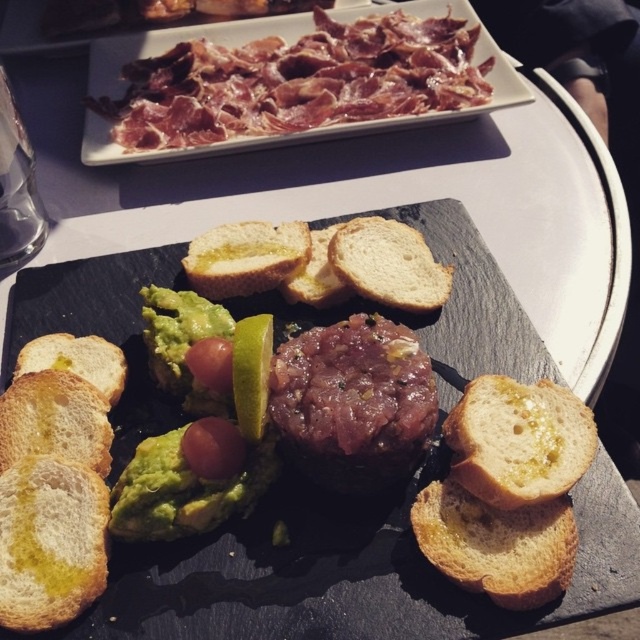
Can you confirm if olive oil toasted bread at center is taller than green creamy guacamole at center-left?

Incorrect, olive oil toasted bread at center's height is not larger of green creamy guacamole at center-left's.

Which is above, olive oil toasted bread at center or green creamy guacamole at center-left?

green creamy guacamole at center-left

Who is more forward, (x=445, y=429) or (x=192, y=394)?

Point (x=445, y=429) is more forward.

This screenshot has height=640, width=640. I want to click on olive oil toasted bread at center, so click(518, 440).

Does point (557, 541) lie in front of point (44, 348)?

Yes, point (557, 541) is closer to viewer.

Is golden crispy bread at lower right above olive oil toasted bread at lower left?

No, golden crispy bread at lower right is not above olive oil toasted bread at lower left.

Where is `golden crispy bread at lower right`? golden crispy bread at lower right is located at coordinates (497, 545).

You are a GUI agent. You are given a task and a screenshot of the screen. Output one action in this format:
    pyautogui.click(x=<x>, y=<y>)
    Task: Click on the golden crispy bread at lower right
    
    Given the screenshot: What is the action you would take?
    pyautogui.click(x=497, y=545)

Between olive oil toasted bread at center and golden crispy bread at left, which one appears on the right side from the viewer's perspective?

From the viewer's perspective, olive oil toasted bread at center appears more on the right side.

The width and height of the screenshot is (640, 640). Describe the element at coordinates (518, 440) in the screenshot. I see `olive oil toasted bread at center` at that location.

Is point (540, 458) behind point (26, 419)?

No, it is not.

Find the location of a particular element. The width and height of the screenshot is (640, 640). olive oil toasted bread at center is located at coordinates (518, 440).